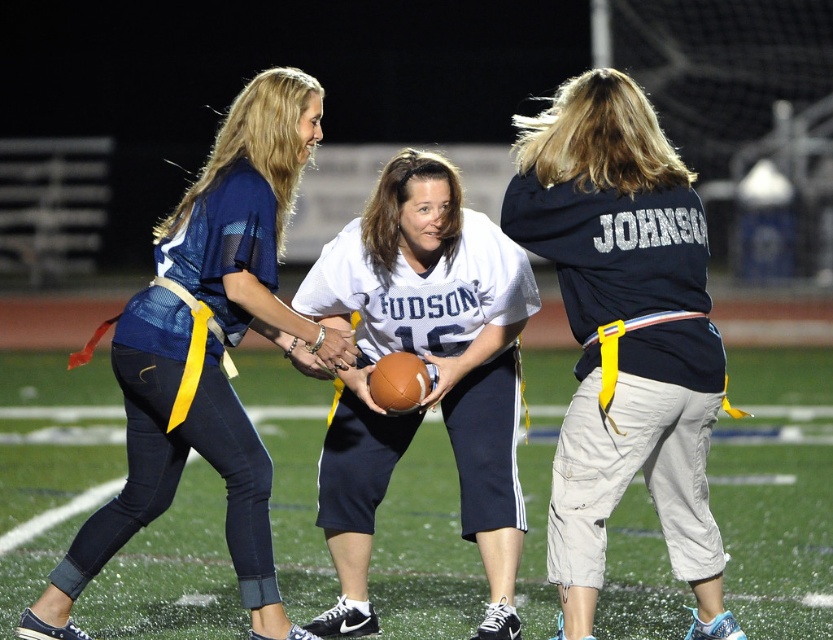
Question: Where is matte blue jersey at center located in relation to white jersey at center in the image?

Choices:
 (A) above
 (B) below

Answer: (A)

Question: In this image, where is green artificial turf at center located relative to matte blue jersey at center?

Choices:
 (A) below
 (B) above

Answer: (A)

Question: Where is green artificial turf at center located in relation to white jersey at center in the image?

Choices:
 (A) above
 (B) below

Answer: (B)

Question: Which point is closer to the camera taking this photo?

Choices:
 (A) (495, 237)
 (B) (253, 316)
 (C) (8, 628)

Answer: (B)

Question: Which of the following is the farthest from the observer?

Choices:
 (A) navy blue jersey at center
 (B) green artificial turf at center
 (C) white jersey at center

Answer: (B)

Question: Estimate the real-world distances between objects in this image. Which object is closer to the white jersey at center?

Choices:
 (A) matte blue jersey at center
 (B) navy blue jersey at center
 (C) green artificial turf at center

Answer: (B)